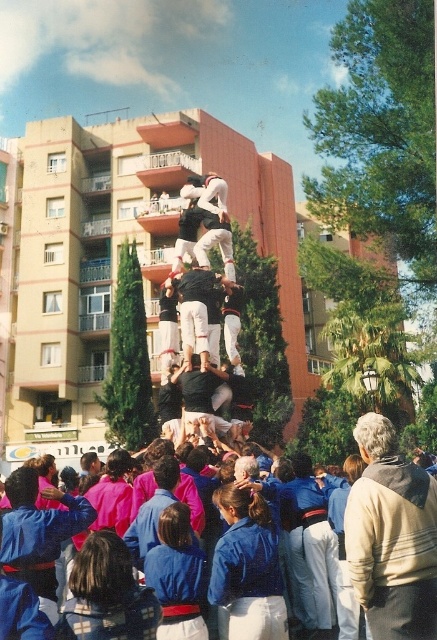
Which is more to the left, beige sweater at center or dark brown leather pants at center?

dark brown leather pants at center

Who is taller, beige sweater at center or dark brown leather pants at center?

beige sweater at center is taller.

Who is more forward, (351, 490) or (207, 353)?

Positioned in front is point (351, 490).

The image size is (437, 640). Identify the location of beige sweater at center. (391, 536).